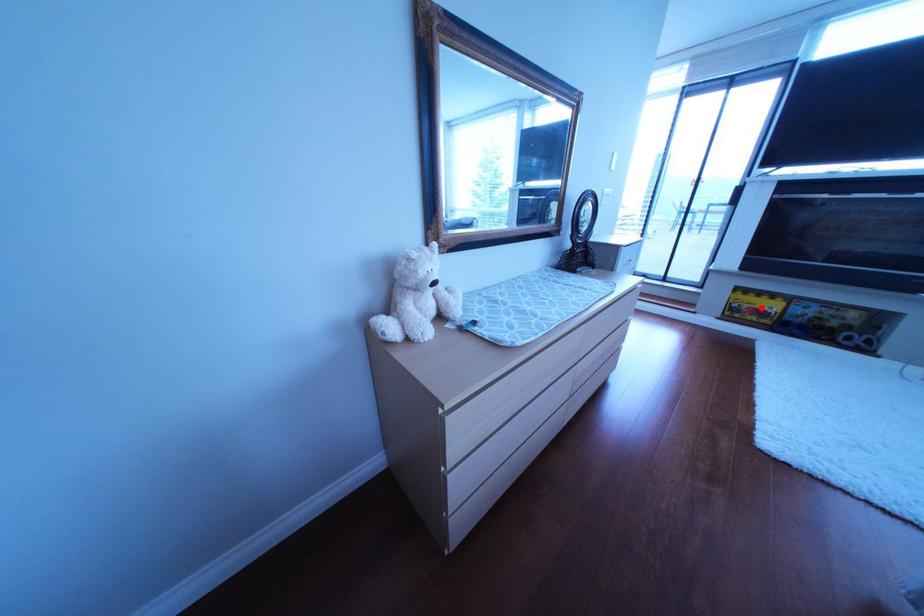
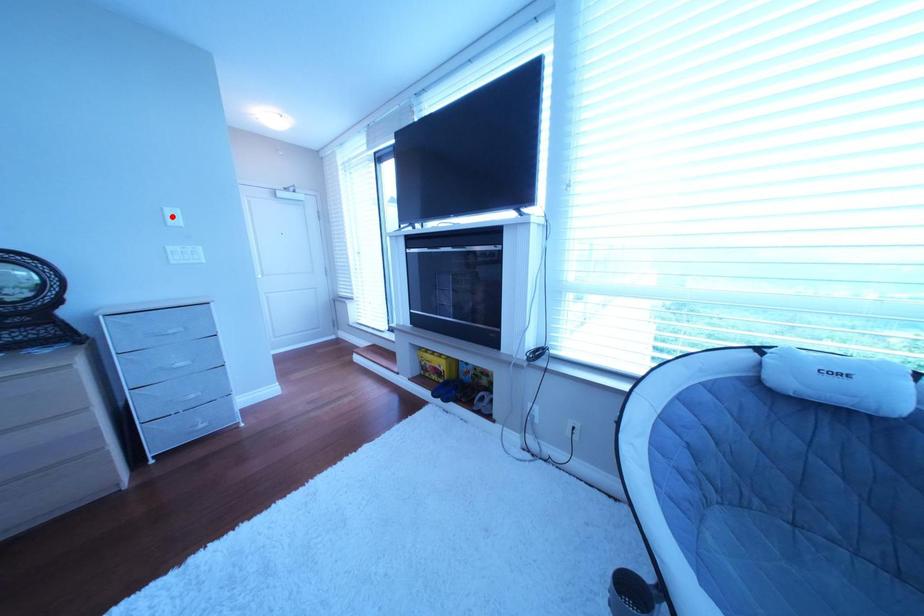
I am providing you with two images of the same scene from different viewpoints. A red point is marked on the first image and another point is marked on the second image. Does the point marked in image1 correspond to the same location as the one in image2?

No